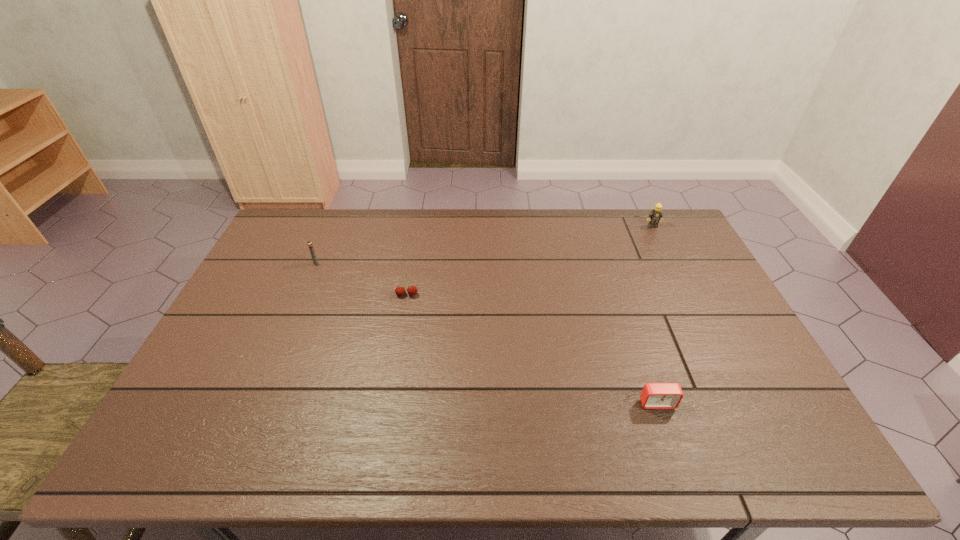
Identify the location of free space located 0.310m on the surface of the second object from left to right. The height and width of the screenshot is (540, 960). (391, 385).

At what (x,y) coordinates should I click in order to perform the action: click on vacant space located on the front-facing side of the shortest object. Please return your answer as a coordinate pair (x, y). The width and height of the screenshot is (960, 540). Looking at the image, I should click on (670, 442).

You are a GUI agent. You are given a task and a screenshot of the screen. Output one action in this format:
    pyautogui.click(x=<x>, y=<y>)
    Task: Click on the object located at the far edge
    The height and width of the screenshot is (540, 960).
    Given the screenshot: What is the action you would take?
    pyautogui.click(x=656, y=215)

The width and height of the screenshot is (960, 540). I want to click on object that is at the right edge, so click(x=656, y=215).

Locate an element on the screen. object that is at the far right corner is located at coordinates (656, 215).

Locate an element on the screen. free space at the far edge of the desktop is located at coordinates (567, 212).

The image size is (960, 540). Identify the location of vacant space at the near edge of the desktop. (252, 430).

Find the location of a particular element. blank space at the left edge of the desktop is located at coordinates (213, 404).

This screenshot has width=960, height=540. In order to click on free space at the right edge of the desktop in this screenshot , I will do `click(676, 291)`.

Where is `vacant space at the near left corner of the desktop`? vacant space at the near left corner of the desktop is located at coordinates (155, 452).